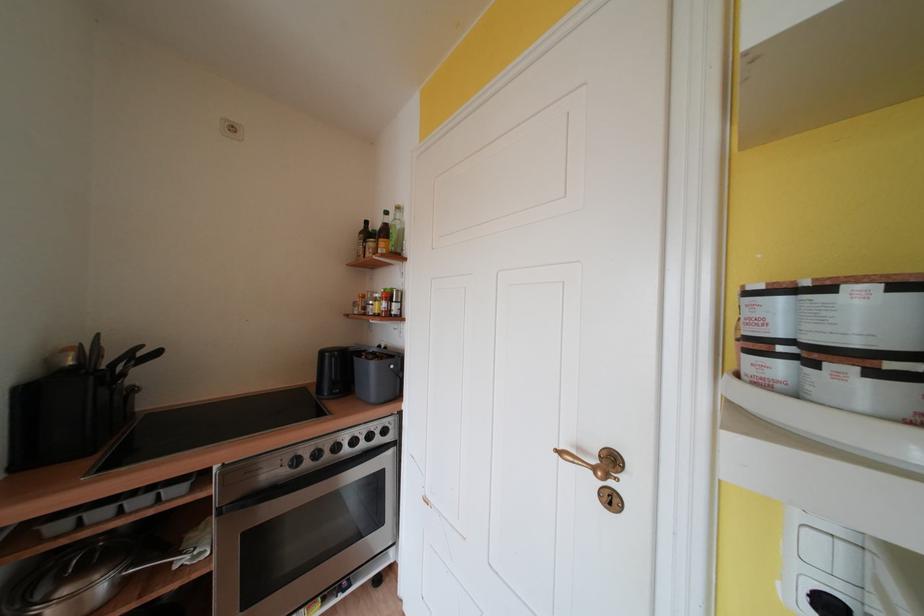
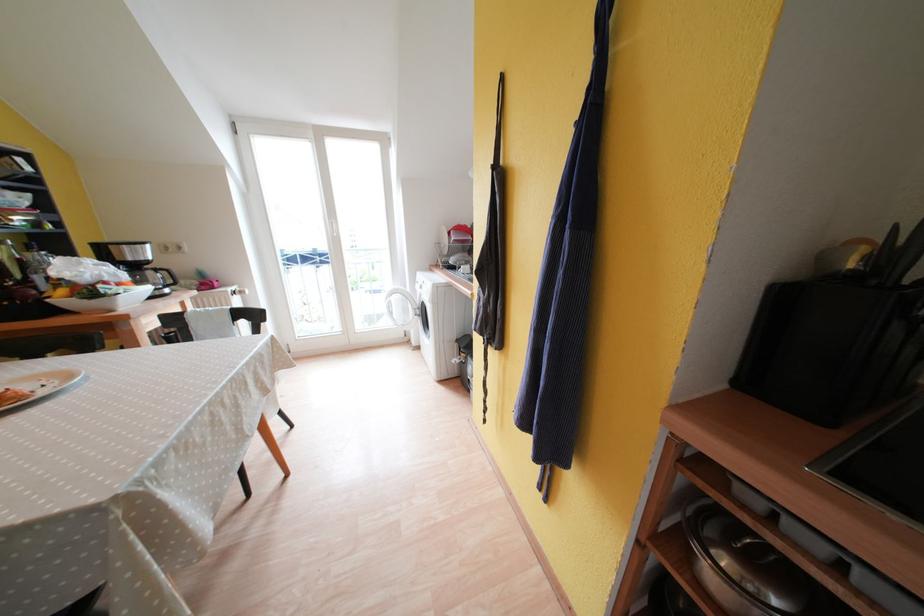
First-person continuous shooting, in which direction is the camera rotating?

The camera rotated toward left-down.